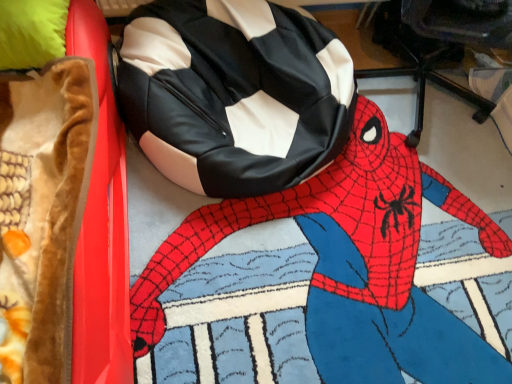
Locate an element on the screen. The image size is (512, 384). vacant area that is in front of black leather bean bag chair at center is located at coordinates (275, 282).